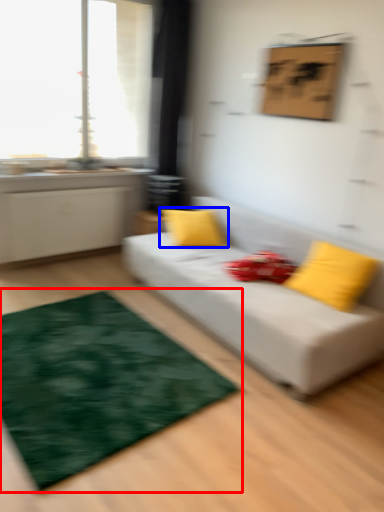
Question: Which object appears farthest to the camera in this image, mat (highlighted by a red box) or pillow (highlighted by a blue box)?

Choices:
 (A) mat
 (B) pillow

Answer: (B)